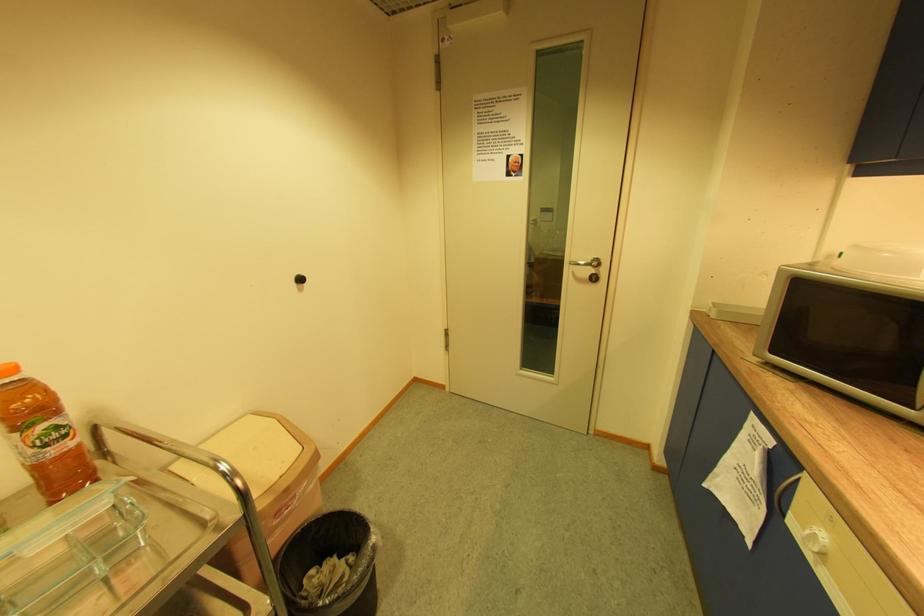
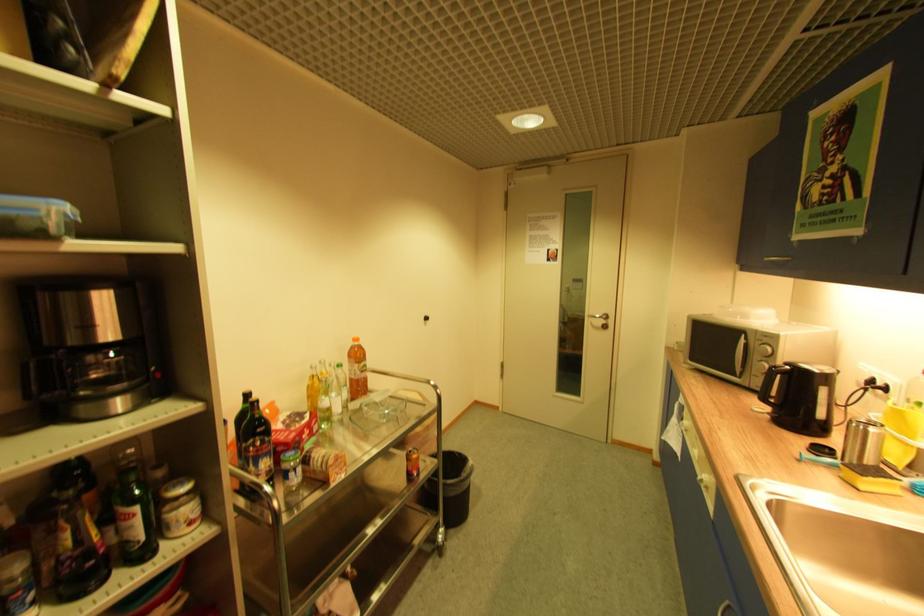
Question: Which direction would the cameraman need to move to produce the second image? Reply with the corresponding letter.

Choices:
 (A) Left
 (B) Right
 (C) Forward
 (D) Backward

Answer: (D)